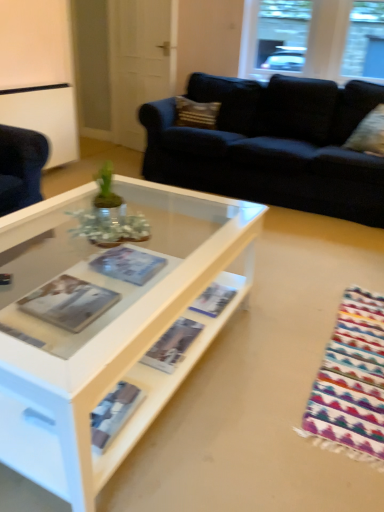
Identify the location of free point above matte paper magazine at center, arranged as the 1th magazine when viewed from the left (from a real-world perspective). (70, 297).